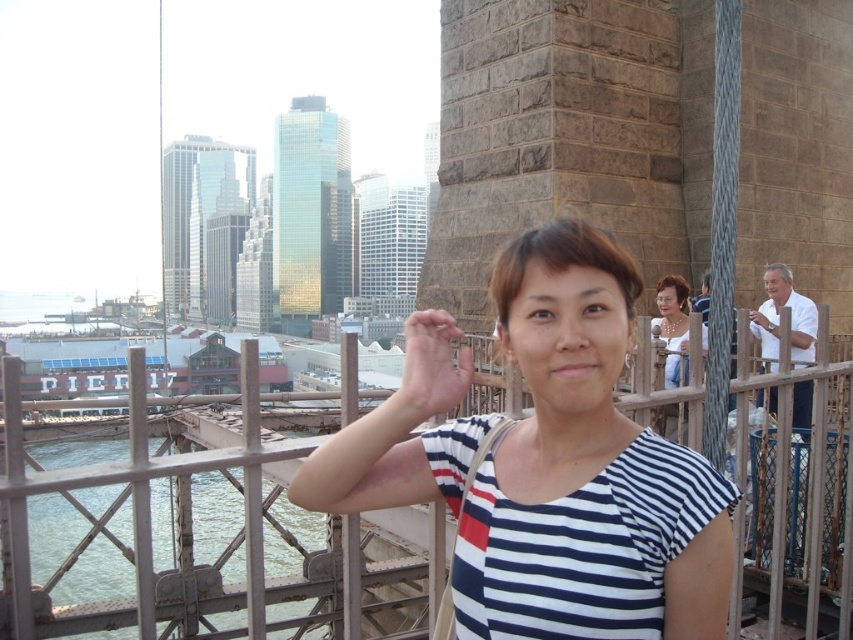
You are a photographer trying to capture a closeup of the matte skin hand at center and the matte gold necklace at upper right in the scene. Since both are in the frame, can you tell me which one is positioned higher in the image?

The matte skin hand at center is much taller than the matte gold necklace at upper right, so the matte skin hand at center is positioned higher in the image.